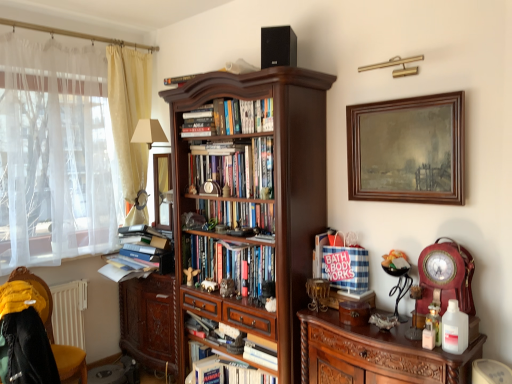
Question: Based on their sizes in the image, would you say yellow fabric curtain at left, the first curtain viewed from the right, is bigger or smaller than wooden clock at right, the 2th picture frame when ordered from top to bottom?

Choices:
 (A) small
 (B) big

Answer: (B)

Question: In terms of height, does yellow fabric curtain at left, marked as the second curtain in a left-to-right arrangement, look taller or shorter compared to wooden clock at right, which is the 1th picture frame from bottom to top?

Choices:
 (A) tall
 (B) short

Answer: (A)

Question: Which of these objects is positioned farthest from the yellow fabric curtain at left, marked as the second curtain in a left-to-right arrangement?

Choices:
 (A) hardcover books at center, which is counted as the third book, starting from the top
 (B) carved wood cabinet at lower left
 (C) dark wood bookcase at center
 (D) white sheer curtain at left, the 2th curtain when ordered from right to left
 (E) hardcover books at center, which appears as the fifth book when ordered from the bottom

Answer: (C)

Question: Estimate the real-world distances between objects in this image. Which object is closer to the black matte speaker at upper center?

Choices:
 (A) hardcover books at center, acting as the 4th book starting from the top
 (B) hardcover books at center, which is counted as the third book, starting from the top
 (C) transparent glass window screen at left
 (D) dark wood bookcase at center
 (E) carved wood cabinet at lower left

Answer: (D)